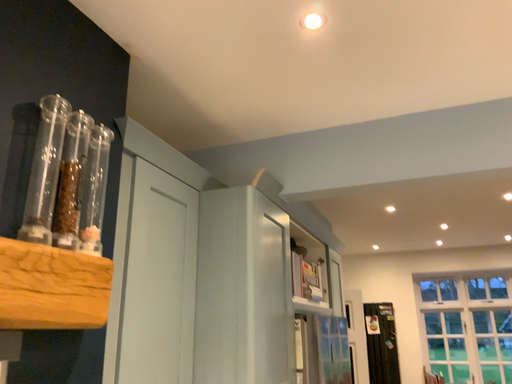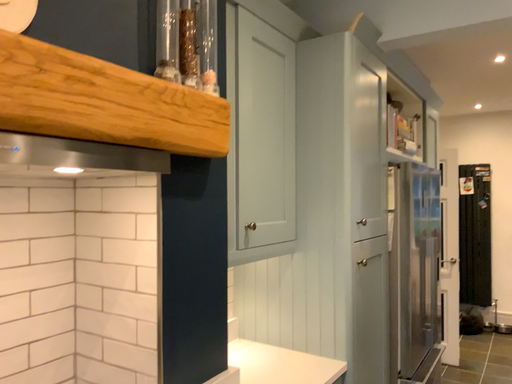
Question: How did the camera likely rotate when shooting the video?

Choices:
 (A) rotated left
 (B) rotated right

Answer: (A)